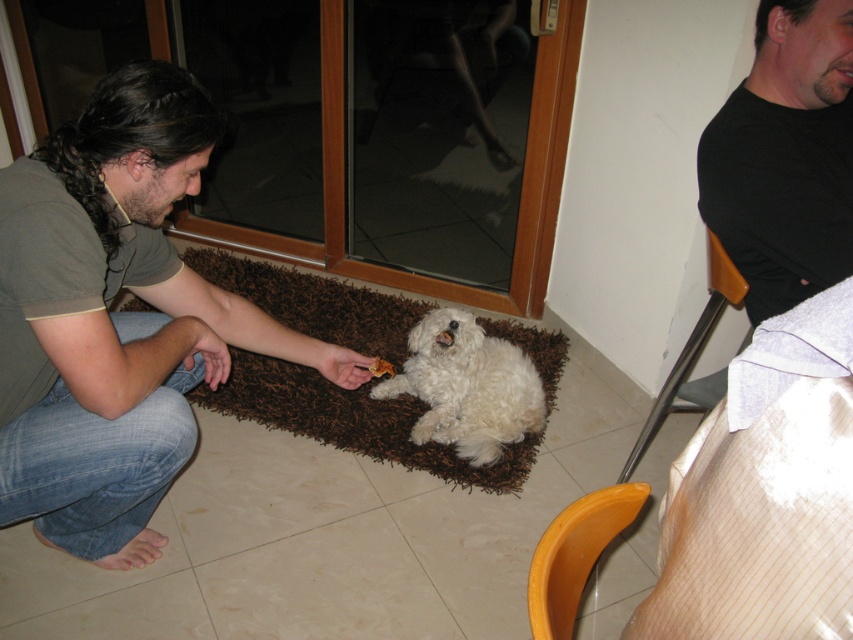
Question: Can you confirm if matte gray shirt at center is positioned to the right of black t-shirt at upper right?

Choices:
 (A) no
 (B) yes

Answer: (A)

Question: Which point appears farthest from the camera in this image?

Choices:
 (A) (248, 360)
 (B) (851, 269)

Answer: (A)

Question: Does matte gray shirt at center appear over black t-shirt at upper right?

Choices:
 (A) yes
 (B) no

Answer: (B)

Question: Can you confirm if matte gray shirt at center is bigger than black t-shirt at upper right?

Choices:
 (A) yes
 (B) no

Answer: (A)

Question: Estimate the real-world distances between objects in this image. Which object is farther from the white fluffy dog at center?

Choices:
 (A) transparent glass door at center
 (B) black t-shirt at upper right
 (C) matte gray shirt at center
 (D) brown shaggy mat at center

Answer: (B)

Question: Which of the following is the farthest from the observer?

Choices:
 (A) (817, 4)
 (B) (453, 385)
 (C) (552, 396)
 (D) (560, 140)

Answer: (D)